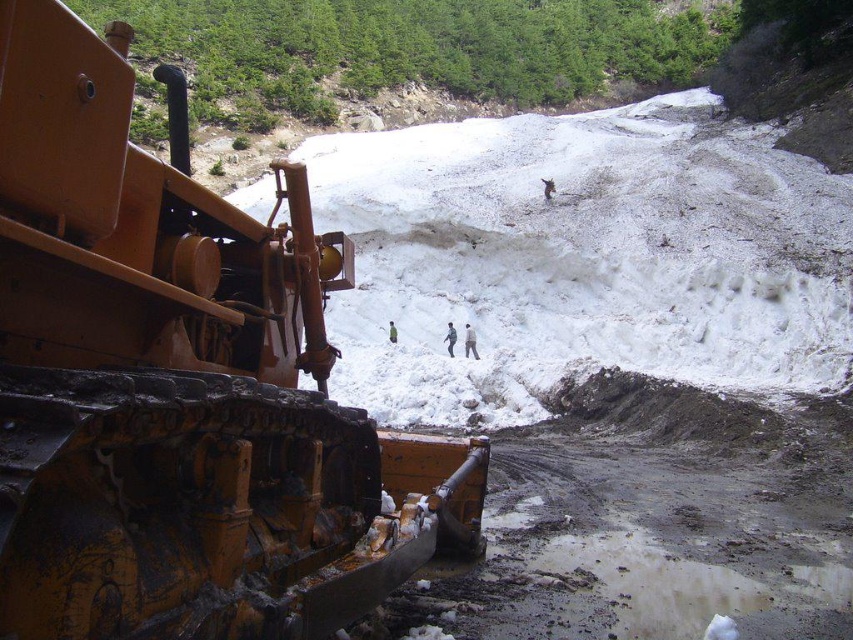
You are standing at the point with coordinates point (x=180, y=384). What object is located to your left?

The point (x=180, y=384) indicates matte yellow tractor at left, so the object to your left is the matte yellow tractor at left.

You are a delivery person trying to reach the dark gray fabric jacket at center, which is your delivery destination. The matte yellow tractor at left is blocking your path. Can you safely detour around the tractor to reach your destination without getting too close?

The matte yellow tractor at left is 20.53 meters away from the dark gray fabric jacket at center. Since the tractor is blocking your path, you can safely detour around it as the distance between them allows enough space to maneuver without getting too close.

You are a delivery person trying to navigate through the snowy path. You see the matte yellow tractor at left and the dark gray fabric jacket at center. Which object is closer to you?

The matte yellow tractor at left is smaller than the dark gray fabric jacket at center, so the dark gray fabric jacket at center is closer to you.